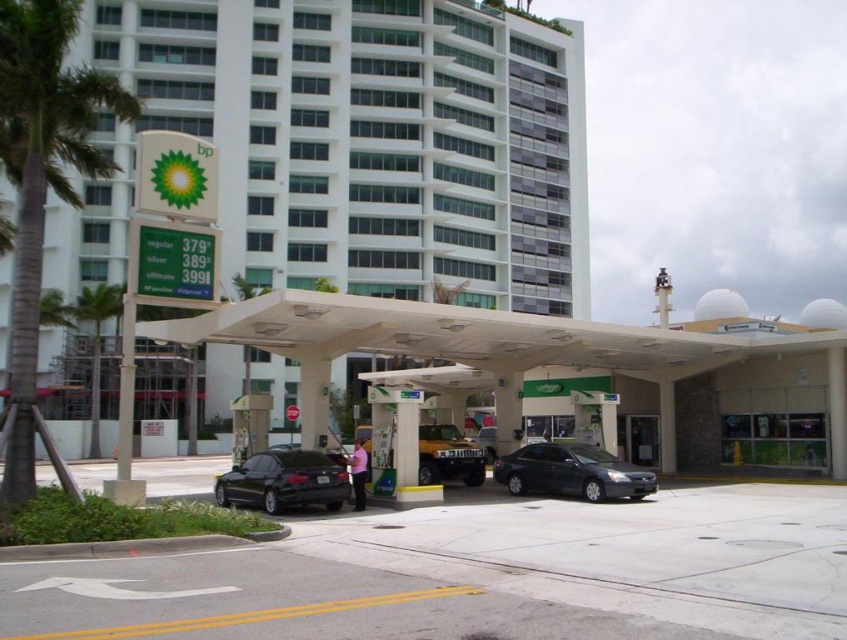
Between shiny black sedan at lower left and metallic gold suv at center, which one has less height?

shiny black sedan at lower left is shorter.

The height and width of the screenshot is (640, 847). Describe the element at coordinates (284, 481) in the screenshot. I see `shiny black sedan at lower left` at that location.

Between point (335, 481) and point (454, 460), which one is positioned in front?

Point (335, 481) is in front.

What are the coordinates of `shiny black sedan at lower left` in the screenshot? It's located at (284, 481).

Who is more distant from viewer, (100, 40) or (591, 465)?

Positioned behind is point (100, 40).

Who is positioned more to the right, white smooth building at upper center or shiny dark gray sedan at center?

shiny dark gray sedan at center is more to the right.

Measure the distance between point (399, 93) and camera.

78.09 meters

Where is `white smooth building at upper center`? This screenshot has height=640, width=847. white smooth building at upper center is located at coordinates (374, 138).

Image resolution: width=847 pixels, height=640 pixels. What do you see at coordinates (284, 481) in the screenshot?
I see `shiny black sedan at lower left` at bounding box center [284, 481].

Does shiny black sedan at lower left come in front of green leafy palm tree at center-left?

Yes, shiny black sedan at lower left is in front of green leafy palm tree at center-left.

Which is behind, point (275, 461) or point (93, 378)?

The point (93, 378) is behind.

Locate an element on the screen. shiny black sedan at lower left is located at coordinates (284, 481).